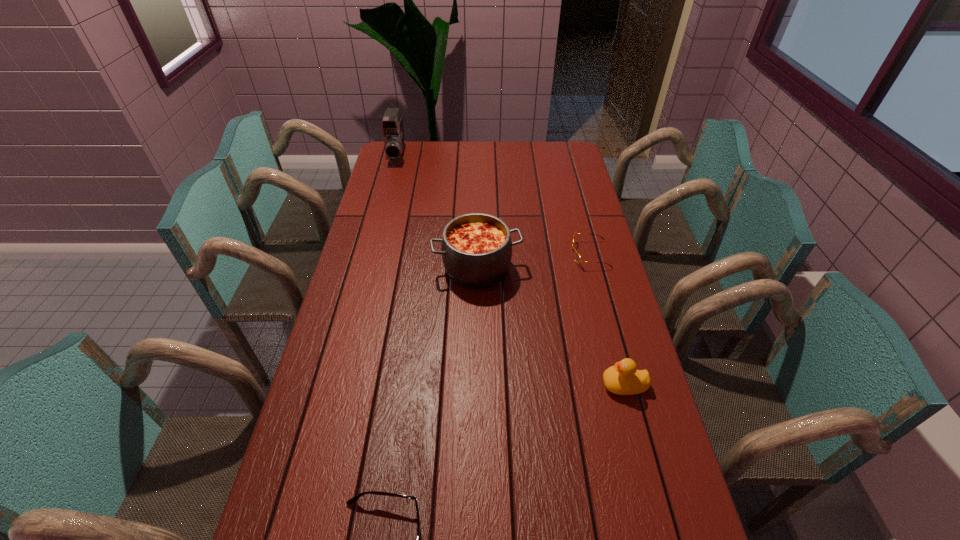
The height and width of the screenshot is (540, 960). In order to click on vacant space located on the face of the third shortest object in this screenshot , I will do `click(507, 385)`.

Where is `vacant region located 0.190m on the front-facing side of the farther spectacles`? vacant region located 0.190m on the front-facing side of the farther spectacles is located at coordinates (517, 254).

Locate an element on the screen. Image resolution: width=960 pixels, height=540 pixels. free location located 0.280m on the front-facing side of the farther spectacles is located at coordinates (492, 254).

This screenshot has width=960, height=540. What are the coordinates of `free spot located on the front-facing side of the farther spectacles` in the screenshot? It's located at (468, 254).

This screenshot has width=960, height=540. Identify the location of object that is at the far edge. (392, 124).

Locate an element on the screen. Image resolution: width=960 pixels, height=540 pixels. object situated at the left edge is located at coordinates point(392,124).

Image resolution: width=960 pixels, height=540 pixels. What are the coordinates of `duck present at the right edge` in the screenshot? It's located at (623, 379).

Where is `spectacles located in the right edge section of the desktop`? spectacles located in the right edge section of the desktop is located at coordinates (577, 257).

At what (x,y) coordinates should I click in order to perform the action: click on object located in the far left corner section of the desktop. Please return your answer as a coordinate pair (x, y). Image resolution: width=960 pixels, height=540 pixels. Looking at the image, I should click on (392, 124).

This screenshot has height=540, width=960. Find the location of `free space at the far edge of the desktop`. free space at the far edge of the desktop is located at coordinates point(476,146).